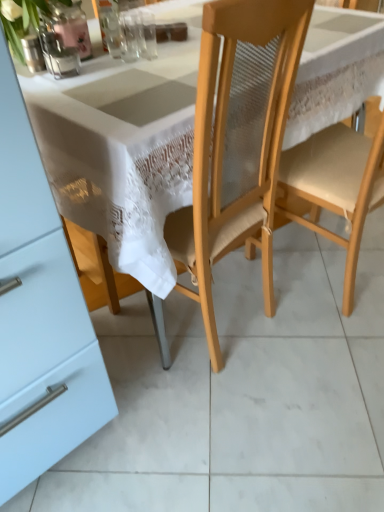
Where is `wooden chair at center, which ranks as the 2th chair in right-to-left order`? wooden chair at center, which ranks as the 2th chair in right-to-left order is located at coordinates (238, 142).

This screenshot has width=384, height=512. Identify the location of transparent glass at upper center, arranged as the first tableware when viewed from the right. (128, 37).

From the picture: How much space does transparent glass at upper center, placed as the 3th tableware when sorted from left to right, occupy vertically?

transparent glass at upper center, placed as the 3th tableware when sorted from left to right, is 4.16 inches tall.

Find the location of a particular element. The height and width of the screenshot is (512, 384). wooden chair at center, which ranks as the 2th chair in right-to-left order is located at coordinates (238, 142).

This screenshot has width=384, height=512. I want to click on chair behind the wooden chair at center, the first chair positioned from the left, so click(x=334, y=187).

Is wooden chair at center, the first chair positioned from the left, positioned in front of light wood chair at center, the 1th chair when ordered from right to left?

Yes, wooden chair at center, the first chair positioned from the left, is in front of light wood chair at center, the 1th chair when ordered from right to left.

How different are the orientations of wooden chair at center, which ranks as the 2th chair in right-to-left order, and light wood chair at center, the 2th chair in the left-to-right sequence, in degrees?

The angle between the facing direction of wooden chair at center, which ranks as the 2th chair in right-to-left order, and the facing direction of light wood chair at center, the 2th chair in the left-to-right sequence, is 10.2 degrees.

From the image's perspective, between wooden chair at center, the first chair positioned from the left, and light wood chair at center, the 2th chair in the left-to-right sequence, who is located below?

wooden chair at center, the first chair positioned from the left, appears lower in the image.

From the image's perspective, who appears lower, clear glass vase at upper center, the second tableware from the right, or light wood chair at center, the 2th chair in the left-to-right sequence?

light wood chair at center, the 2th chair in the left-to-right sequence, from the image's perspective.

From a real-world perspective, which tableware is the 3rd one above the light wood chair at center, the 2th chair in the left-to-right sequence? Please provide its 2D coordinates.

[(109, 26)]

What's the angular difference between clear glass vase at upper center, the 2th tableware when ordered from left to right, and light wood chair at center, the 1th chair when ordered from right to left,'s facing directions?

clear glass vase at upper center, the 2th tableware when ordered from left to right, and light wood chair at center, the 1th chair when ordered from right to left, are facing 120 degrees away from each other.

Which of these two, clear glass vase at upper center, the 2th tableware when ordered from left to right, or light wood chair at center, the 2th chair in the left-to-right sequence, stands taller?

light wood chair at center, the 2th chair in the left-to-right sequence.

Does light wood chair at center, the 2th chair in the left-to-right sequence, have a lesser height compared to matte glass vase at upper left, the third tableware viewed from the right?

No, light wood chair at center, the 2th chair in the left-to-right sequence, is not shorter than matte glass vase at upper left, the third tableware viewed from the right.

From the image's perspective, is light wood chair at center, the 1th chair when ordered from right to left, positioned above or below matte glass vase at upper left, which is counted as the first tableware, starting from the left?

Based on their image positions, light wood chair at center, the 1th chair when ordered from right to left, is located beneath matte glass vase at upper left, which is counted as the first tableware, starting from the left.

From a real-world perspective, count 1st tablewares upward from the light wood chair at center, the 1th chair when ordered from right to left, and point to it. Please provide its 2D coordinates.

[(33, 53)]

Does point (306, 167) come behind point (33, 50)?

Yes, point (306, 167) is behind point (33, 50).

Where is `the 2nd chair in front of the clear glass vase at upper center, the 2th tableware when ordered from left to right, counting from the anchor's position`? Image resolution: width=384 pixels, height=512 pixels. the 2nd chair in front of the clear glass vase at upper center, the 2th tableware when ordered from left to right, counting from the anchor's position is located at coordinates (238, 142).

Relative to clear glass vase at upper center, the 2th tableware when ordered from left to right, is wooden chair at center, which ranks as the 2th chair in right-to-left order, in front or behind?

Visually, wooden chair at center, which ranks as the 2th chair in right-to-left order, is located in front of clear glass vase at upper center, the 2th tableware when ordered from left to right.

In the scene shown: Considering the relative sizes of wooden chair at center, the first chair positioned from the left, and clear glass vase at upper center, the 2th tableware when ordered from left to right, in the image provided, is wooden chair at center, the first chair positioned from the left, thinner than clear glass vase at upper center, the 2th tableware when ordered from left to right,?

No.

Can you confirm if wooden chair at center, the first chair positioned from the left, is positioned to the left of clear glass vase at upper center, the second tableware from the right?

Incorrect, wooden chair at center, the first chair positioned from the left, is not on the left side of clear glass vase at upper center, the second tableware from the right.

From the picture: From a real-world perspective, which is physically below, transparent glass at upper center, placed as the 3th tableware when sorted from left to right, or clear glass vase at upper center, the 2th tableware when ordered from left to right?

transparent glass at upper center, placed as the 3th tableware when sorted from left to right.

Is point (119, 23) farther from viewer compared to point (114, 9)?

Yes.

I want to click on tableware to the right of clear glass vase at upper center, the 2th tableware when ordered from left to right, so click(x=128, y=37).

Which object is further away from the camera taking this photo, clear glass vase at upper center, the second tableware from the right, or transparent glass at upper center, arranged as the first tableware when viewed from the right?

clear glass vase at upper center, the second tableware from the right, is further from the camera.

Is transparent glass at upper center, placed as the 3th tableware when sorted from left to right, a part of clear glass vase at upper center, the second tableware from the right?

Actually, transparent glass at upper center, placed as the 3th tableware when sorted from left to right, is outside clear glass vase at upper center, the second tableware from the right.

From a real-world perspective, is clear glass vase at upper center, the second tableware from the right, below transparent glass at upper center, arranged as the first tableware when viewed from the right?

No, from a real-world perspective, clear glass vase at upper center, the second tableware from the right, is not under transparent glass at upper center, arranged as the first tableware when viewed from the right.

Is clear glass vase at upper center, the 2th tableware when ordered from left to right, facing away from transparent glass at upper center, arranged as the first tableware when viewed from the right?

No, transparent glass at upper center, arranged as the first tableware when viewed from the right, is not at the back of clear glass vase at upper center, the 2th tableware when ordered from left to right.

Is wooden chair at center, which ranks as the 2th chair in right-to-left order, bigger or smaller than transparent glass at upper center, arranged as the first tableware when viewed from the right?

Clearly, wooden chair at center, which ranks as the 2th chair in right-to-left order, is larger in size than transparent glass at upper center, arranged as the first tableware when viewed from the right.

Looking at their sizes, would you say wooden chair at center, which ranks as the 2th chair in right-to-left order, is wider or thinner than transparent glass at upper center, arranged as the first tableware when viewed from the right?

Considering their sizes, wooden chair at center, which ranks as the 2th chair in right-to-left order, looks broader than transparent glass at upper center, arranged as the first tableware when viewed from the right.

Visually, is wooden chair at center, the first chair positioned from the left, positioned to the left or to the right of transparent glass at upper center, placed as the 3th tableware when sorted from left to right?

In the image, wooden chair at center, the first chair positioned from the left, appears on the right side of transparent glass at upper center, placed as the 3th tableware when sorted from left to right.

Measure the distance between wooden chair at center, which ranks as the 2th chair in right-to-left order, and transparent glass at upper center, placed as the 3th tableware when sorted from left to right.

A distance of 21.08 inches exists between wooden chair at center, which ranks as the 2th chair in right-to-left order, and transparent glass at upper center, placed as the 3th tableware when sorted from left to right.

Find the location of a particular element. This screenshot has width=384, height=512. chair in front of the light wood chair at center, the 2th chair in the left-to-right sequence is located at coordinates (x=238, y=142).

At what (x,y) coordinates should I click in order to perform the action: click on the 3rd tableware behind the light wood chair at center, the 1th chair when ordered from right to left. Please return your answer as a coordinate pair (x, y). Looking at the image, I should click on (109, 26).

When comparing their distances from transparent glass at upper center, placed as the 3th tableware when sorted from left to right, does light wood chair at center, the 2th chair in the left-to-right sequence, or clear glass vase at upper center, the 2th tableware when ordered from left to right, seem closer?

clear glass vase at upper center, the 2th tableware when ordered from left to right, is closer to transparent glass at upper center, placed as the 3th tableware when sorted from left to right.

Based on their spatial positions, is matte glass vase at upper left, which is counted as the first tableware, starting from the left, or clear glass vase at upper center, the second tableware from the right, closer to transparent glass at upper center, arranged as the first tableware when viewed from the right?

clear glass vase at upper center, the second tableware from the right, is positioned closer to the anchor transparent glass at upper center, arranged as the first tableware when viewed from the right.

When comparing their distances from light wood chair at center, the 2th chair in the left-to-right sequence, does wooden chair at center, the first chair positioned from the left, or transparent glass at upper center, arranged as the first tableware when viewed from the right, seem closer?

wooden chair at center, the first chair positioned from the left, lies closer to light wood chair at center, the 2th chair in the left-to-right sequence, than the other object.

Estimate the real-world distances between objects in this image. Which object is closer to matte glass vase at upper left, the third tableware viewed from the right, transparent glass at upper center, placed as the 3th tableware when sorted from left to right, or light wood chair at center, the 1th chair when ordered from right to left?

transparent glass at upper center, placed as the 3th tableware when sorted from left to right, is positioned closer to the anchor matte glass vase at upper left, the third tableware viewed from the right.

From the image, which object appears to be farther from clear glass vase at upper center, the 2th tableware when ordered from left to right, transparent glass at upper center, arranged as the first tableware when viewed from the right, or matte glass vase at upper left, the third tableware viewed from the right?

Among the two, matte glass vase at upper left, the third tableware viewed from the right, is located further to clear glass vase at upper center, the 2th tableware when ordered from left to right.

Estimate the real-world distances between objects in this image. Which object is closer to matte glass vase at upper left, the third tableware viewed from the right, clear glass vase at upper center, the second tableware from the right, or transparent glass at upper center, arranged as the first tableware when viewed from the right?

Among the two, clear glass vase at upper center, the second tableware from the right, is located nearer to matte glass vase at upper left, the third tableware viewed from the right.

When comparing their distances from matte glass vase at upper left, the third tableware viewed from the right, does transparent glass at upper center, arranged as the first tableware when viewed from the right, or clear glass vase at upper center, the 2th tableware when ordered from left to right, seem closer?

The object closer to matte glass vase at upper left, the third tableware viewed from the right, is clear glass vase at upper center, the 2th tableware when ordered from left to right.

Looking at the image, which one is located further to clear glass vase at upper center, the 2th tableware when ordered from left to right, transparent glass at upper center, arranged as the first tableware when viewed from the right, or light wood chair at center, the 1th chair when ordered from right to left?

light wood chair at center, the 1th chair when ordered from right to left, lies further to clear glass vase at upper center, the 2th tableware when ordered from left to right, than the other object.

The width and height of the screenshot is (384, 512). What are the coordinates of `chair between matte glass vase at upper left, which is counted as the first tableware, starting from the left, and light wood chair at center, the 2th chair in the left-to-right sequence, in the horizontal direction` in the screenshot? It's located at (238, 142).

This screenshot has width=384, height=512. I want to click on chair located between clear glass vase at upper center, the second tableware from the right, and light wood chair at center, the 2th chair in the left-to-right sequence, in the left-right direction, so click(x=238, y=142).

Locate an element on the screen. The width and height of the screenshot is (384, 512). tableware between wooden chair at center, the first chair positioned from the left, and matte glass vase at upper left, which is counted as the first tableware, starting from the left, in the front-back direction is located at coordinates (128, 37).

The width and height of the screenshot is (384, 512). In order to click on chair between transparent glass at upper center, arranged as the first tableware when viewed from the right, and light wood chair at center, the 1th chair when ordered from right to left, from left to right in this screenshot , I will do `click(238, 142)`.